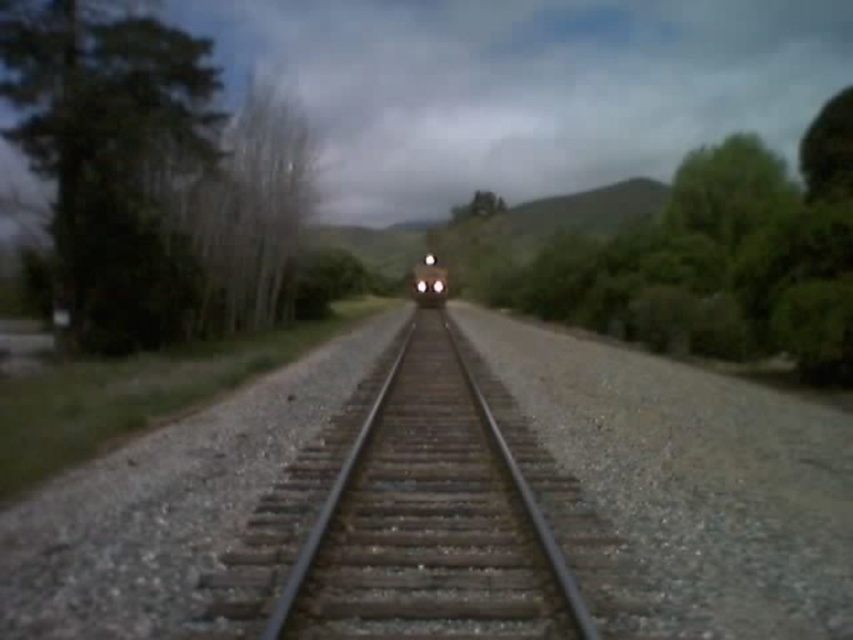
Question: Which object is farther from the camera taking this photo?

Choices:
 (A) matte black train at center
 (B) shiny silver train at center
 (C) metal track at center
 (D) green leafy tree at right

Answer: (B)

Question: Which object appears farthest from the camera in this image?

Choices:
 (A) green leafy tree at right
 (B) metal track at center

Answer: (A)

Question: Is green leafy tree at left thinner than metal track at center?

Choices:
 (A) yes
 (B) no

Answer: (B)

Question: Is green leafy tree at left above green leafy tree at right?

Choices:
 (A) no
 (B) yes

Answer: (A)

Question: Can you confirm if shiny silver train at center is smaller than matte black train at center?

Choices:
 (A) yes
 (B) no

Answer: (B)

Question: Which object appears closest to the camera in this image?

Choices:
 (A) matte black train at center
 (B) metal track at center

Answer: (B)